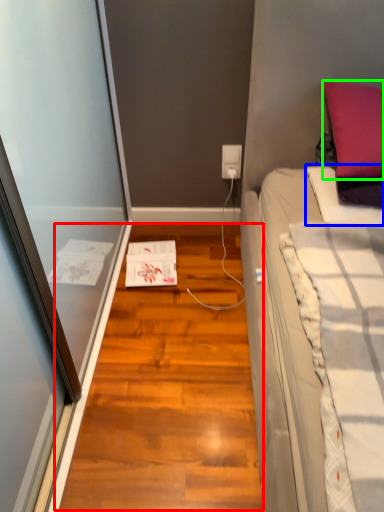
Question: Which object is the closest to the hardwood (highlighted by a red box)? Choose among these: blanket (highlighted by a blue box) or pillow (highlighted by a green box).

Choices:
 (A) blanket
 (B) pillow

Answer: (A)